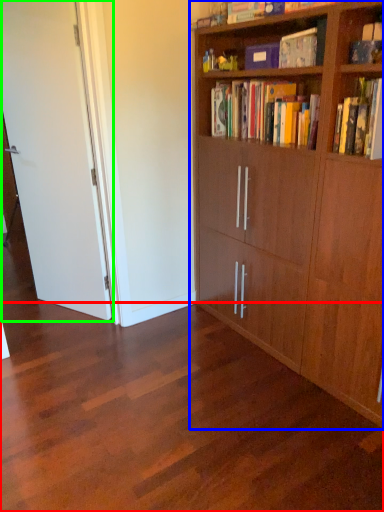
Question: Which object is positioned farthest from plain (highlighted by a red box)? Select from bookcase (highlighted by a blue box) and door (highlighted by a green box).

Choices:
 (A) bookcase
 (B) door

Answer: (B)